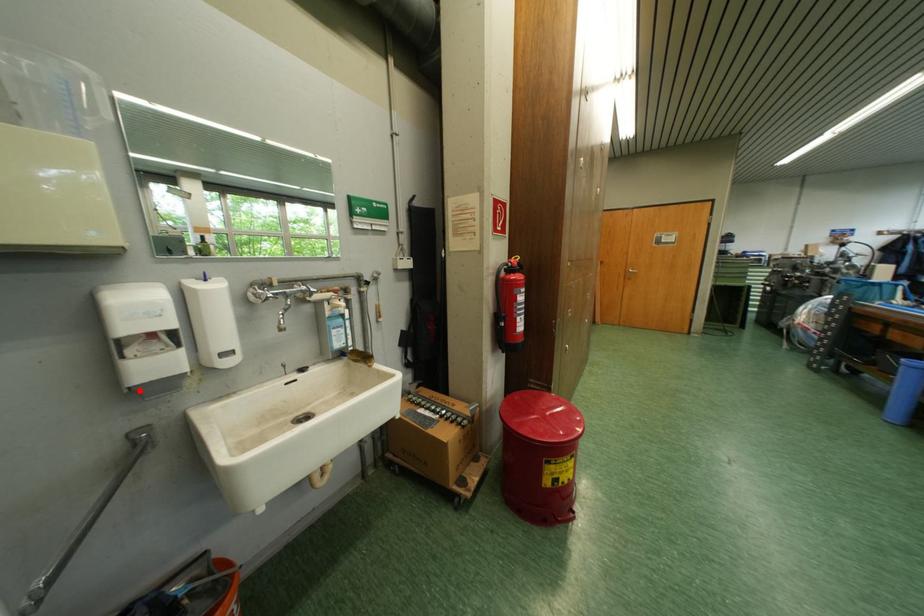
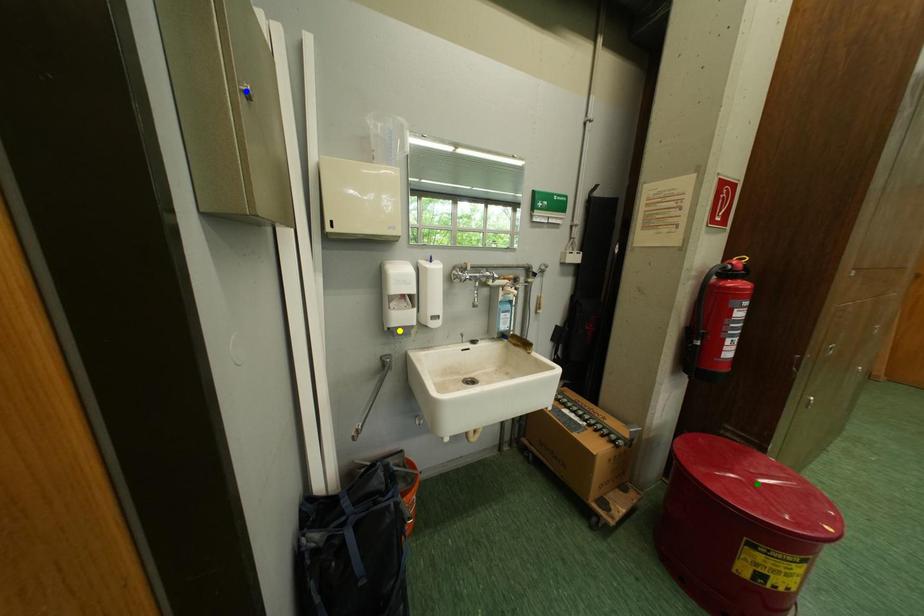
Question: I am providing you with two images of the same scene from different viewpoints. A red point is marked on the first image. You are given multiple points on the second image. Which point in image 2 represents the same 3d spot as the red point in image 1?

Choices:
 (A) blue point
 (B) yellow point
 (C) green point

Answer: (B)